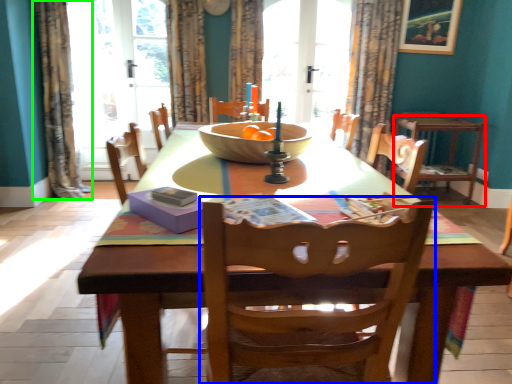
Question: Which object is the farthest from chair (highlighted by a red box)? Choose among these: chair (highlighted by a blue box) or curtain (highlighted by a green box).

Choices:
 (A) chair
 (B) curtain

Answer: (B)